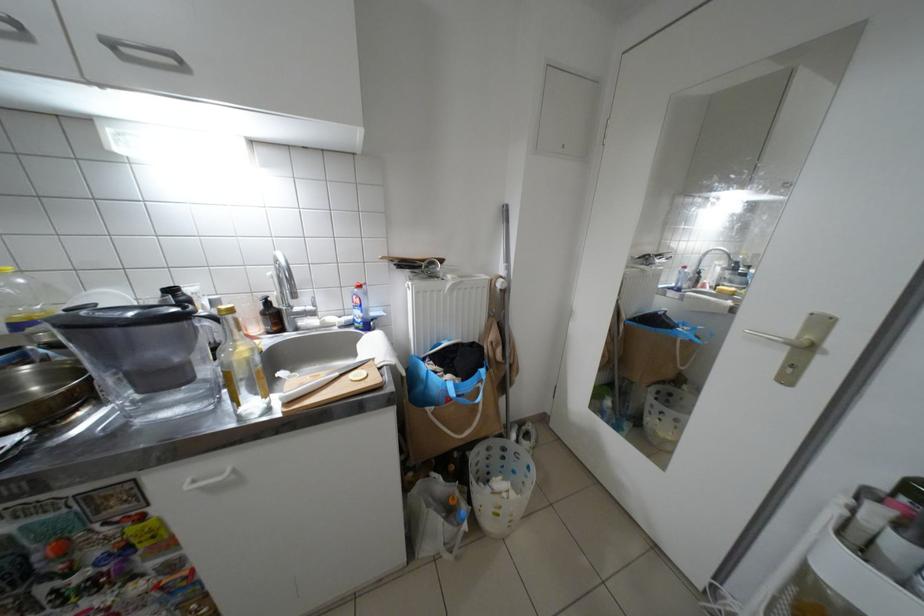
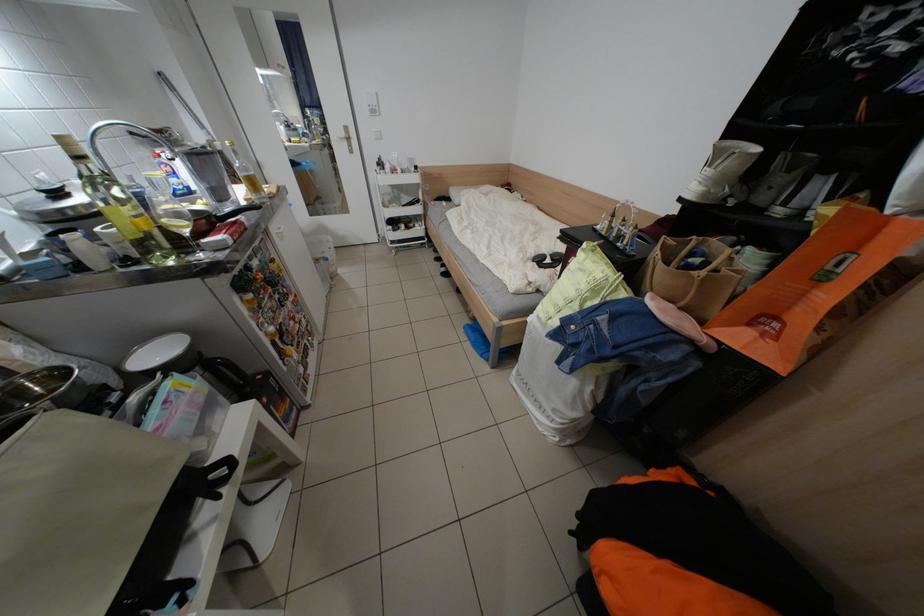
Find the pixel in the second image that matches (512,285) in the first image.

(231, 148)